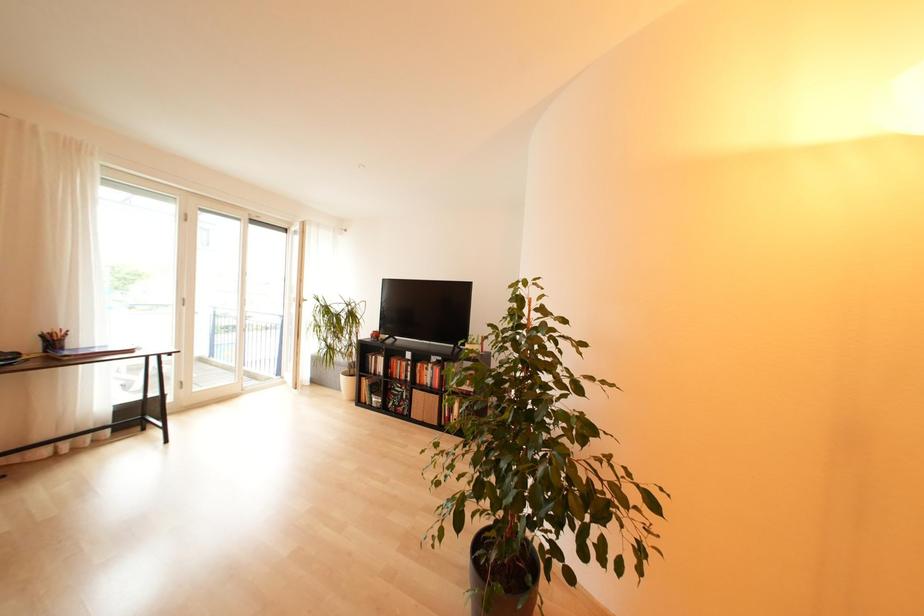
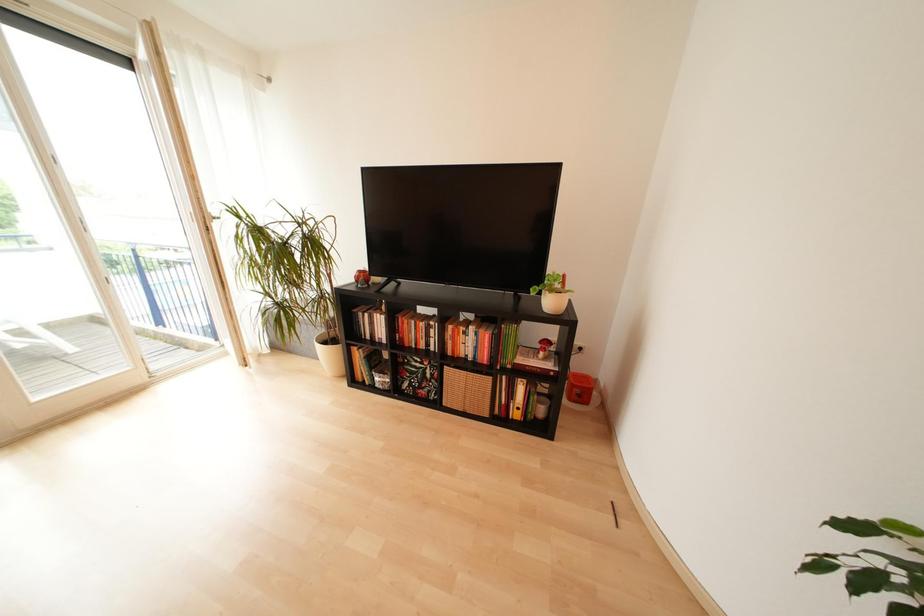
What movement of the cameraman would produce the second image?

The movement direction of the cameraman is left, forward.